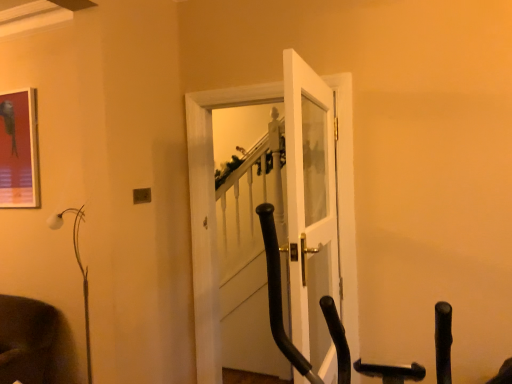
Question: From a real-world perspective, is metallic glossy picture frame at upper left beneath white glossy door at center, placed as the 1th door when sorted from back to front?

Choices:
 (A) no
 (B) yes

Answer: (A)

Question: Does metallic glossy picture frame at upper left have a greater height compared to white glossy door at center, which is the 2th door from front to back?

Choices:
 (A) yes
 (B) no

Answer: (B)

Question: Is white glossy door at center, placed as the 1th door when sorted from back to front, at the back of metallic glossy picture frame at upper left?

Choices:
 (A) yes
 (B) no

Answer: (B)

Question: Would you say white glossy door at center, which is the 2th door from front to back, is part of metallic glossy picture frame at upper left's contents?

Choices:
 (A) yes
 (B) no

Answer: (B)

Question: Is metallic glossy picture frame at upper left with white glossy door at center, which is the 2th door from front to back?

Choices:
 (A) yes
 (B) no

Answer: (B)

Question: Choose the correct answer: Is white glossy door at center, placed as the 1th door when sorted from back to front, inside white glass door at center, the 1th door positioned from the front, or outside it?

Choices:
 (A) outside
 (B) inside

Answer: (A)

Question: Considering the positions of white glossy door at center, placed as the 1th door when sorted from back to front, and white glass door at center, the 1th door positioned from the front, in the image, is white glossy door at center, placed as the 1th door when sorted from back to front, taller or shorter than white glass door at center, the 1th door positioned from the front,?

Choices:
 (A) tall
 (B) short

Answer: (A)

Question: Considering the positions of white glossy door at center, placed as the 1th door when sorted from back to front, and white glass door at center, the 1th door positioned from the front, in the image, is white glossy door at center, placed as the 1th door when sorted from back to front, bigger or smaller than white glass door at center, the 1th door positioned from the front,?

Choices:
 (A) big
 (B) small

Answer: (A)

Question: Is point (203, 99) positioned closer to the camera than point (324, 140)?

Choices:
 (A) closer
 (B) farther

Answer: (B)

Question: Would you say white matte floor lamp at left is to the left or to the right of white glossy door at center, which is the 2th door from front to back, in the picture?

Choices:
 (A) right
 (B) left

Answer: (B)

Question: Is white matte floor lamp at left taller or shorter than white glossy door at center, which is the 2th door from front to back?

Choices:
 (A) tall
 (B) short

Answer: (B)

Question: Considering the positions of point (53, 223) and point (201, 322), is point (53, 223) closer or farther from the camera than point (201, 322)?

Choices:
 (A) farther
 (B) closer

Answer: (A)

Question: Is white matte floor lamp at left spatially inside white glossy door at center, placed as the 1th door when sorted from back to front, or outside of it?

Choices:
 (A) inside
 (B) outside

Answer: (B)

Question: Is metallic glossy picture frame at upper left to the left or to the right of white matte floor lamp at left in the image?

Choices:
 (A) left
 (B) right

Answer: (A)

Question: From a real-world perspective, is metallic glossy picture frame at upper left above or below white matte floor lamp at left?

Choices:
 (A) above
 (B) below

Answer: (A)